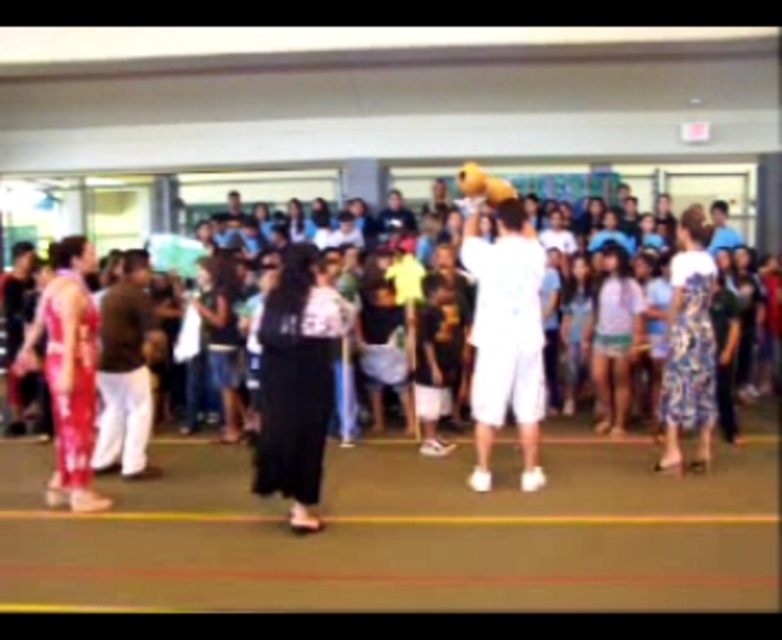
Between black fabric dress at center and shiny red fabric pants at left, which one is positioned lower?

black fabric dress at center is below.

Measure the distance from black fabric dress at center to shiny red fabric pants at left.

4.53 feet

Locate an element on the screen. The height and width of the screenshot is (640, 782). black fabric dress at center is located at coordinates (296, 384).

You are a GUI agent. You are given a task and a screenshot of the screen. Output one action in this format:
    pyautogui.click(x=<x>, y=<y>)
    Task: Click on the black fabric dress at center
    
    Given the screenshot: What is the action you would take?
    pyautogui.click(x=296, y=384)

Who is lower down, white cotton shorts at center or shiny red fabric pants at left?

Positioned lower is shiny red fabric pants at left.

Does point (513, 385) come farther from viewer compared to point (38, 332)?

Yes, point (513, 385) is behind point (38, 332).

This screenshot has width=782, height=640. I want to click on white cotton shorts at center, so click(x=504, y=337).

Between black fabric dress at center and white cotton shorts at center, which one has less height?

black fabric dress at center

Who is more forward, [262,381] or [531,273]?

Positioned in front is point [262,381].

Between point (303, 401) and point (533, 460), which one is positioned behind?

Positioned behind is point (533, 460).

Find the location of a particular element. This screenshot has width=782, height=640. black fabric dress at center is located at coordinates (296, 384).